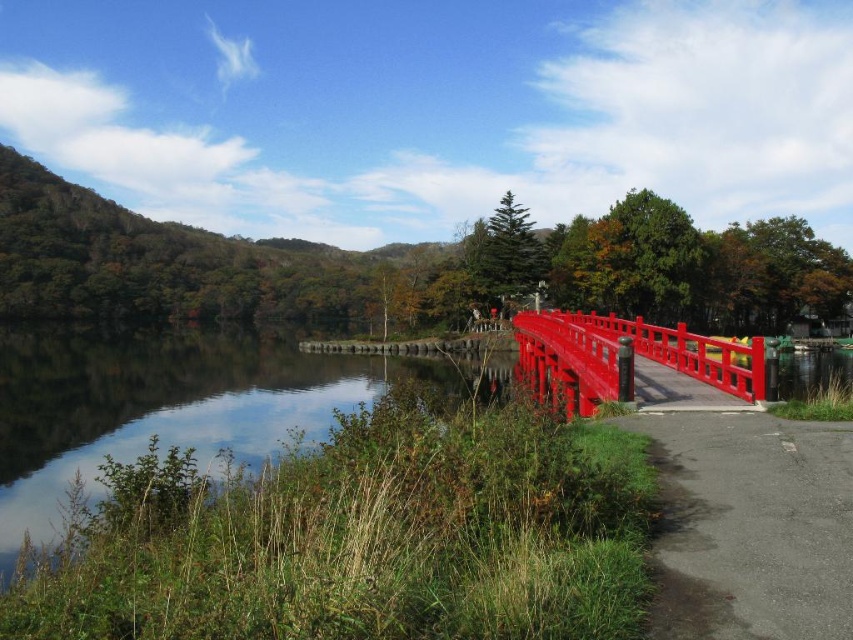
Question: Based on their relative distances, which object is farther from the clear water at center?

Choices:
 (A) glossy wood bridge at center
 (B) gray asphalt path at lower right

Answer: (B)

Question: Is clear water at center wider than gray asphalt path at lower right?

Choices:
 (A) yes
 (B) no

Answer: (A)

Question: Which of the following is the closest to the observer?

Choices:
 (A) gray asphalt path at lower right
 (B) glossy wood bridge at center

Answer: (A)

Question: Does clear water at center appear under glossy wood bridge at center?

Choices:
 (A) yes
 (B) no

Answer: (A)

Question: Does clear water at center have a larger size compared to glossy wood bridge at center?

Choices:
 (A) yes
 (B) no

Answer: (A)

Question: Among these points, which one is nearest to the camera?

Choices:
 (A) (1, 396)
 (B) (631, 388)

Answer: (B)